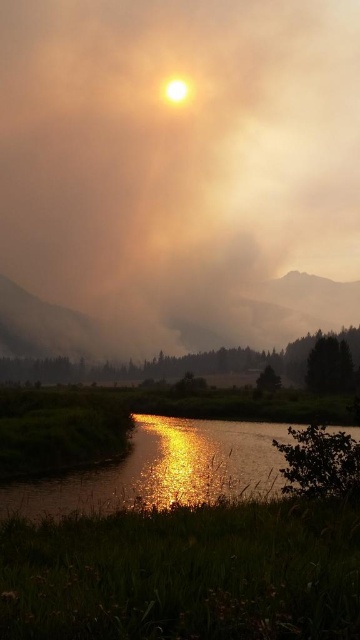
Question: Does foggy smoke at upper center have a larger size compared to shiny reflective water at lower center?

Choices:
 (A) yes
 (B) no

Answer: (A)

Question: Among these points, which one is farthest from the camera?

Choices:
 (A) (119, 12)
 (B) (156, 448)

Answer: (A)

Question: Does foggy smoke at upper center have a larger size compared to shiny reflective water at lower center?

Choices:
 (A) yes
 (B) no

Answer: (A)

Question: Which point is farther from the camera taking this photo?

Choices:
 (A) (81, 90)
 (B) (132, 480)

Answer: (A)

Question: Is foggy smoke at upper center wider than shiny reflective water at lower center?

Choices:
 (A) no
 (B) yes

Answer: (B)